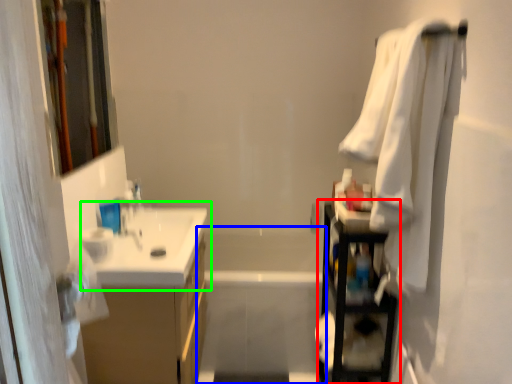
Question: Based on their relative distances, which object is nearer to shelf (highlighted by a red box)? Choose from bath (highlighted by a blue box) and sink (highlighted by a green box).

Choices:
 (A) bath
 (B) sink

Answer: (A)